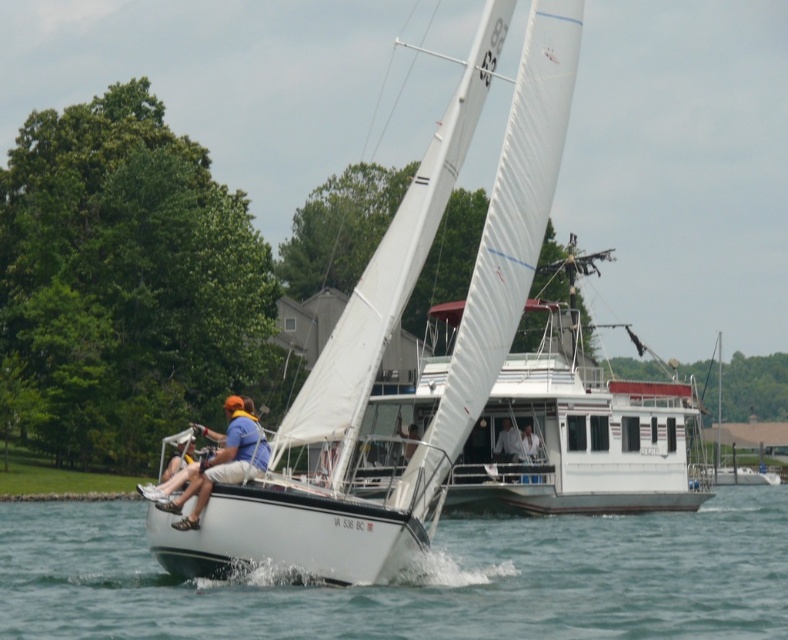
Between white glossy sailboat at center and white fabric shirt at center, which one appears on the left side from the viewer's perspective?

white glossy sailboat at center is more to the left.

Is white glossy sailboat at center bigger than white fabric shirt at center?

Correct, white glossy sailboat at center is larger in size than white fabric shirt at center.

Is point (474, 477) in front of point (530, 460)?

Yes, point (474, 477) is in front of point (530, 460).

The width and height of the screenshot is (788, 640). I want to click on white glossy sailboat at center, so click(x=580, y=435).

Does white smooth water at center appear under white glossy sailboat at center?

Yes.

Does point (426, 616) lie behind point (429, 317)?

No, it is in front of (429, 317).

The width and height of the screenshot is (788, 640). Identify the location of white smooth water at center. (418, 579).

Looking at this image, is white smooth water at center shorter than white fabric sailboat at center?

No, white smooth water at center is not shorter than white fabric sailboat at center.

Which is in front, point (703, 516) or point (504, 417)?

Point (504, 417)

In the scene shown: Measure the distance between white smooth water at center and camera.

The distance of white smooth water at center from camera is 175.37 feet.

The image size is (788, 640). I want to click on white smooth water at center, so click(x=418, y=579).